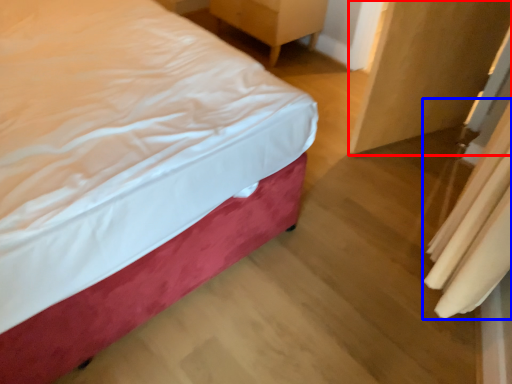
Question: Which of the following is the closest to the observer, armoire (highlighted by a red box) or curtain (highlighted by a blue box)?

Choices:
 (A) armoire
 (B) curtain

Answer: (B)